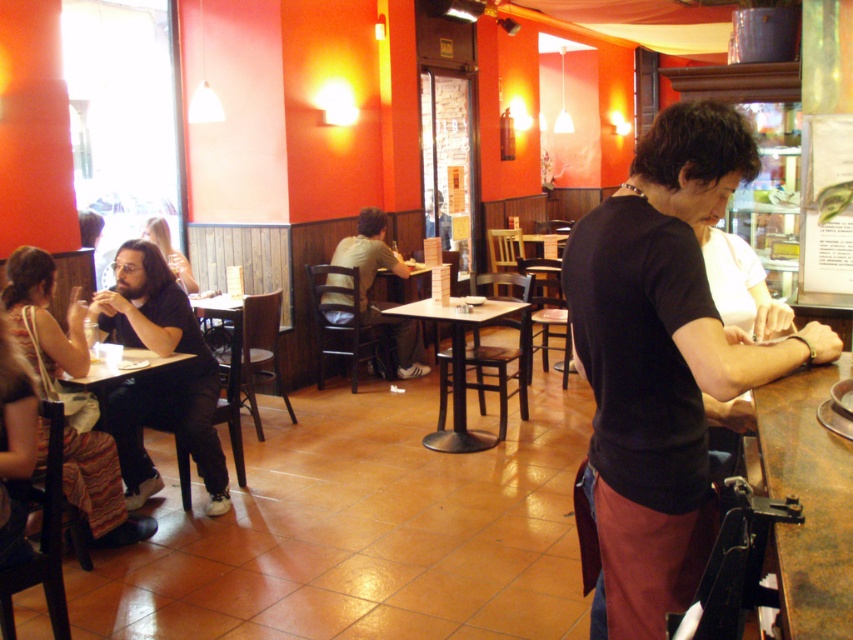
The height and width of the screenshot is (640, 853). In order to click on black matte shirt at bar in this screenshot , I will do `click(664, 362)`.

Is point (718, 129) positioned in front of point (114, 474)?

That is True.

Locate an element on the screen. This screenshot has width=853, height=640. black matte shirt at bar is located at coordinates (664, 362).

Between matte black shirt at left and matte black hair at upper left, which one has more height?

Standing taller between the two is matte black shirt at left.

What do you see at coordinates (160, 376) in the screenshot?
I see `matte black shirt at left` at bounding box center [160, 376].

Find the location of a particular element. This screenshot has width=853, height=640. matte black shirt at left is located at coordinates (160, 376).

Does brown woven bag at left appear under light brown wood chair at center?

Yes, brown woven bag at left is below light brown wood chair at center.

From the picture: Between brown woven bag at left and light brown wood chair at center, which one appears on the right side from the viewer's perspective?

Positioned to the right is light brown wood chair at center.

Which is in front, point (45, 253) or point (393, 333)?

Positioned in front is point (45, 253).

Identify the location of brown woven bag at left. The height and width of the screenshot is (640, 853). coord(44,316).